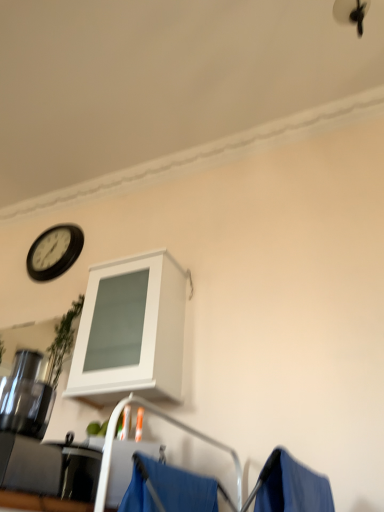
Describe the element at coordinates (167, 489) in the screenshot. Image resolution: width=384 pixels, height=512 pixels. I see `blue fabric at lower center` at that location.

The width and height of the screenshot is (384, 512). I want to click on white matte cabinet at upper center, so click(130, 331).

Considering the positions of objects white matte cabinet at upper center and black plastic clock at upper left in the image provided, who is more to the right, white matte cabinet at upper center or black plastic clock at upper left?

white matte cabinet at upper center.

Could you tell me if white matte cabinet at upper center is facing black plastic clock at upper left?

No, white matte cabinet at upper center is not turned towards black plastic clock at upper left.

What's the angular difference between white matte cabinet at upper center and black plastic clock at upper left's facing directions?

The angular difference between white matte cabinet at upper center and black plastic clock at upper left is 7.82e-05 degrees.

Where is `wall clock that is on the left side of white matte cabinet at upper center`? Image resolution: width=384 pixels, height=512 pixels. wall clock that is on the left side of white matte cabinet at upper center is located at coordinates (54, 252).

From a real-world perspective, is black plastic clock at upper left physically located above or below blue fabric at lower center?

From a real-world perspective, black plastic clock at upper left is physically above blue fabric at lower center.

Find the location of a particular element. curtain that is in front of the black plastic clock at upper left is located at coordinates (167, 489).

Which object is positioned more to the right, black plastic clock at upper left or blue fabric at lower center?

Positioned to the right is blue fabric at lower center.

Considering the points (51, 249) and (133, 509), which point is in front, point (51, 249) or point (133, 509)?

Positioned in front is point (133, 509).

Is black plastic clock at upper left taller than white matte cabinet at upper center?

Incorrect, the height of black plastic clock at upper left is not larger of that of white matte cabinet at upper center.

Choose the correct answer: Is black plastic clock at upper left inside white matte cabinet at upper center or outside it?

black plastic clock at upper left is not inside white matte cabinet at upper center, it's outside.

Is black plastic clock at upper left not near white matte cabinet at upper center?

Indeed, black plastic clock at upper left is not near white matte cabinet at upper center.

Between black plastic clock at upper left and white matte cabinet at upper center, which one is positioned behind?

black plastic clock at upper left is behind.

Does blue fabric at lower center turn towards white matte cabinet at upper center?

No.

Which is behind, blue fabric at lower center or white matte cabinet at upper center?

white matte cabinet at upper center is behind.

How different are the orientations of blue fabric at lower center and white matte cabinet at upper center in degrees?

The angular difference between blue fabric at lower center and white matte cabinet at upper center is 88 degrees.

Where is `cabinetry that appears above the blue fabric at lower center (from the image's perspective)`? Image resolution: width=384 pixels, height=512 pixels. cabinetry that appears above the blue fabric at lower center (from the image's perspective) is located at coordinates (130, 331).

Is point (116, 292) farther from viewer compared to point (157, 469)?

That is True.

Does white matte cabinet at upper center have a lesser height compared to blue fabric at lower center?

In fact, white matte cabinet at upper center may be taller than blue fabric at lower center.

Is white matte cabinet at upper center not near blue fabric at lower center?

That's not correct — white matte cabinet at upper center is a little close to blue fabric at lower center.

From the image's perspective, is white matte cabinet at upper center located above blue fabric at lower center?

Yes, from the image's perspective, white matte cabinet at upper center is over blue fabric at lower center.

Would you say blue fabric at lower center contains black plastic clock at upper left?

No.

Is point (145, 476) less distant than point (53, 230)?

Yes, point (145, 476) is in front of point (53, 230).

Identify the location of wall clock on the left of white matte cabinet at upper center. The width and height of the screenshot is (384, 512). (54, 252).

In the image, there is a black plastic clock at upper left. Where is `curtain below it (from a real-world perspective)`? The image size is (384, 512). curtain below it (from a real-world perspective) is located at coordinates (167, 489).

Looking at the image, which one is located further to white matte cabinet at upper center, blue fabric at lower center or black plastic clock at upper left?

Among the two, black plastic clock at upper left is located further to white matte cabinet at upper center.

Based on their spatial positions, is blue fabric at lower center or white matte cabinet at upper center closer to black plastic clock at upper left?

white matte cabinet at upper center lies closer to black plastic clock at upper left than the other object.

Which object lies nearer to the anchor point blue fabric at lower center, black plastic clock at upper left or white matte cabinet at upper center?

Among the two, white matte cabinet at upper center is located nearer to blue fabric at lower center.

Looking at the image, which one is located closer to black plastic clock at upper left, white matte cabinet at upper center or blue fabric at lower center?

Based on the image, white matte cabinet at upper center appears to be nearer to black plastic clock at upper left.

Estimate the real-world distances between objects in this image. Which object is closer to blue fabric at lower center, white matte cabinet at upper center or black plastic clock at upper left?

Based on the image, white matte cabinet at upper center appears to be nearer to blue fabric at lower center.

Which object lies further to the anchor point white matte cabinet at upper center, black plastic clock at upper left or blue fabric at lower center?

Based on the image, black plastic clock at upper left appears to be further to white matte cabinet at upper center.

In order to click on cabinetry located between blue fabric at lower center and black plastic clock at upper left in the depth direction in this screenshot , I will do `click(130, 331)`.